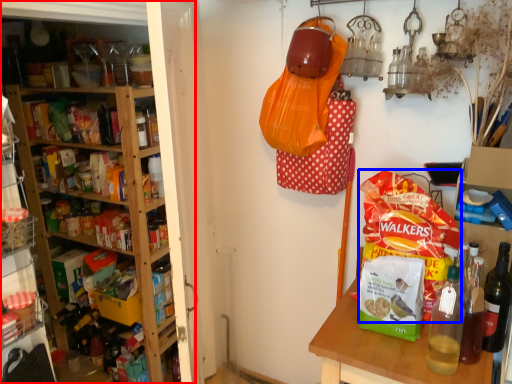
Question: Which object is further to the camera taking this photo, shelf (highlighted by a red box) or snack (highlighted by a blue box)?

Choices:
 (A) shelf
 (B) snack

Answer: (B)